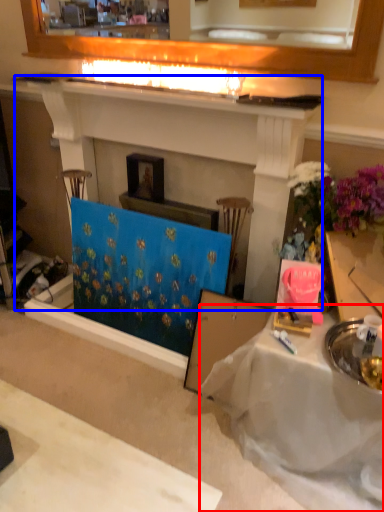
Question: Which object appears closest to the camera in this image, table (highlighted by a red box) or fireplace (highlighted by a blue box)?

Choices:
 (A) table
 (B) fireplace

Answer: (A)